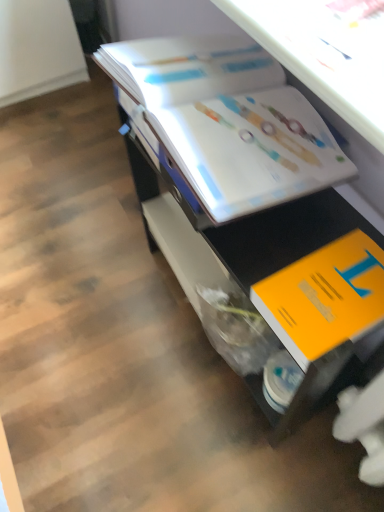
Identify the location of vacant space in front of white glossy book at upper center. (220, 453).